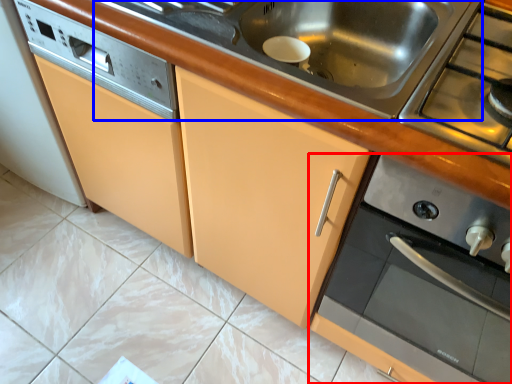
Question: Which point is further to the camera, home appliance (highlighted by a red box) or sink (highlighted by a blue box)?

Choices:
 (A) home appliance
 (B) sink

Answer: (B)